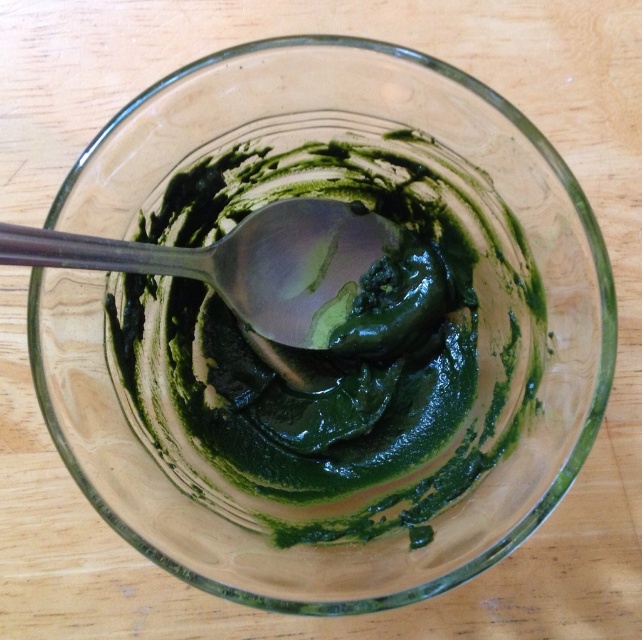
Question: Considering the relative positions of green matte paste at center and metallic silver spoon at center in the image provided, where is green matte paste at center located with respect to metallic silver spoon at center?

Choices:
 (A) above
 (B) below

Answer: (B)

Question: Is green matte paste at center wider than metallic silver spoon at center?

Choices:
 (A) yes
 (B) no

Answer: (A)

Question: Which point is closer to the camera taking this photo?

Choices:
 (A) (521, 413)
 (B) (209, 264)

Answer: (A)

Question: Which point is farther from the camera taking this photo?

Choices:
 (A) (279, 310)
 (B) (361, 390)

Answer: (B)

Question: Which point is closer to the camera taking this photo?

Choices:
 (A) (266, 225)
 (B) (379, 412)

Answer: (A)

Question: Does green matte paste at center have a greater width compared to metallic silver spoon at center?

Choices:
 (A) no
 (B) yes

Answer: (B)